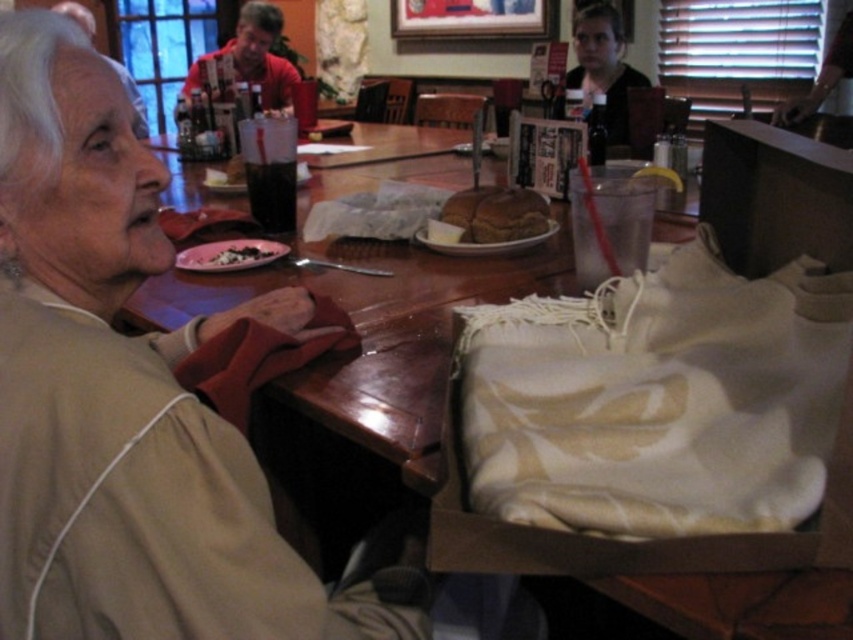
Between wooden table at center and red shirt at upper center, which one is positioned higher?

red shirt at upper center is higher up.

Is wooden table at center smaller than red shirt at upper center?

Incorrect, wooden table at center is not smaller in size than red shirt at upper center.

Describe the element at coordinates (376, 330) in the screenshot. I see `wooden table at center` at that location.

Locate an element on the screen. The image size is (853, 640). wooden table at center is located at coordinates (376, 330).

I want to click on brown crusty bread at center, so (x=496, y=212).

The height and width of the screenshot is (640, 853). What do you see at coordinates (496, 212) in the screenshot? I see `brown crusty bread at center` at bounding box center [496, 212].

You are a GUI agent. You are given a task and a screenshot of the screen. Output one action in this format:
    pyautogui.click(x=<x>, y=<y>)
    Task: Click on the brown crusty bread at center
    The height and width of the screenshot is (640, 853).
    Given the screenshot: What is the action you would take?
    pyautogui.click(x=496, y=212)

Which is above, matte black jacket at upper center or black matte food at center?

Positioned higher is matte black jacket at upper center.

Between matte black jacket at upper center and black matte food at center, which one appears on the right side from the viewer's perspective?

Positioned to the right is matte black jacket at upper center.

Which is in front, point (590, 80) or point (213, 262)?

Positioned in front is point (213, 262).

Where is `matte black jacket at upper center`? matte black jacket at upper center is located at coordinates (602, 65).